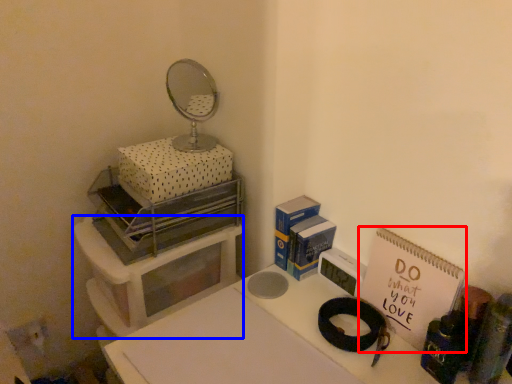
Question: Which of the following is the farthest to the observer, notebook (highlighted by a red box) or furniture (highlighted by a blue box)?

Choices:
 (A) notebook
 (B) furniture

Answer: (B)